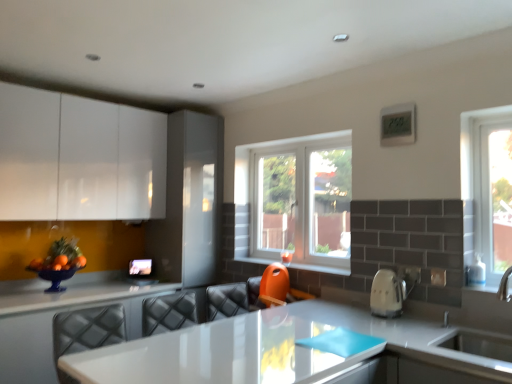
Question: Is white glossy countertop at lower center to the left or to the right of orange plastic at center in the image?

Choices:
 (A) left
 (B) right

Answer: (A)

Question: From the image's perspective, is white glossy countertop at lower center above or below orange plastic at center?

Choices:
 (A) above
 (B) below

Answer: (B)

Question: Estimate the real-world distances between objects in this image. Which object is farther from the white glossy table at center?

Choices:
 (A) white glossy electric kettle at right
 (B) white glossy countertop at lower center
 (C) orange plastic at center
 (D) white plastic window at center
 (E) orange plastic swivel chair at center

Answer: (B)

Question: Which object is the closest to the white glossy countertop at lower center?

Choices:
 (A) white plastic window at center
 (B) white glossy cabinets at upper left
 (C) white glossy sink at lower right
 (D) white glossy electric kettle at right
 (E) white glossy table at center

Answer: (B)